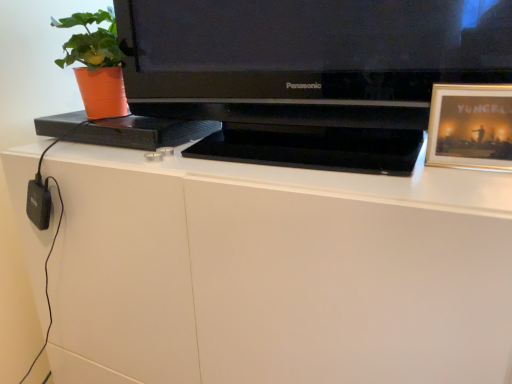
Question: Is orange plastic pot at left not inside black glossy television at center?

Choices:
 (A) no
 (B) yes

Answer: (B)

Question: Can you confirm if orange plastic pot at left is thinner than black glossy television at center?

Choices:
 (A) yes
 (B) no

Answer: (A)

Question: Is there a large distance between orange plastic pot at left and black glossy television at center?

Choices:
 (A) no
 (B) yes

Answer: (A)

Question: Does orange plastic pot at left have a larger size compared to black glossy television at center?

Choices:
 (A) yes
 (B) no

Answer: (B)

Question: Is orange plastic pot at left in contact with black glossy television at center?

Choices:
 (A) yes
 (B) no

Answer: (B)

Question: Does orange plastic pot at left contain black glossy television at center?

Choices:
 (A) yes
 (B) no

Answer: (B)

Question: Is white matte desk at center to the left of orange plastic pot at left from the viewer's perspective?

Choices:
 (A) no
 (B) yes

Answer: (A)

Question: Does white matte desk at center have a smaller size compared to orange plastic pot at left?

Choices:
 (A) yes
 (B) no

Answer: (B)

Question: Considering the relative sizes of white matte desk at center and orange plastic pot at left in the image provided, is white matte desk at center taller than orange plastic pot at left?

Choices:
 (A) yes
 (B) no

Answer: (A)

Question: Is white matte desk at center positioned beyond the bounds of orange plastic pot at left?

Choices:
 (A) no
 (B) yes

Answer: (B)

Question: Can you confirm if white matte desk at center is bigger than orange plastic pot at left?

Choices:
 (A) no
 (B) yes

Answer: (B)

Question: Is white matte desk at center thinner than orange plastic pot at left?

Choices:
 (A) no
 (B) yes

Answer: (A)

Question: Considering the relative positions of gold-framed picture at upper right and orange plastic pot at left in the image provided, is gold-framed picture at upper right behind orange plastic pot at left?

Choices:
 (A) yes
 (B) no

Answer: (B)